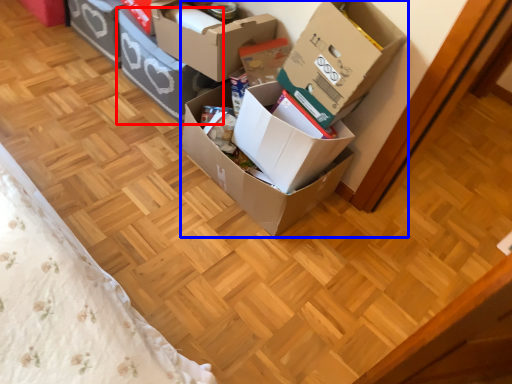
Question: Which object appears farthest to the camera in this image, box (highlighted by a red box) or box (highlighted by a blue box)?

Choices:
 (A) box
 (B) box

Answer: (A)